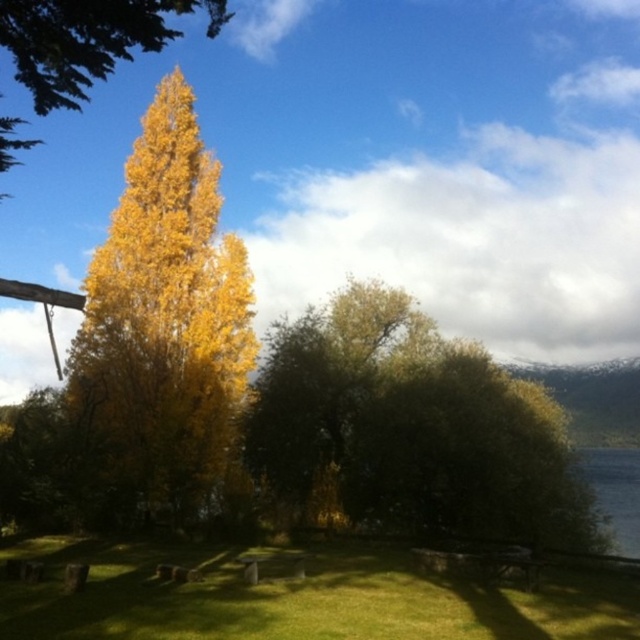
Question: Which point is farther to the camera?

Choices:
 (A) (134, 36)
 (B) (392, 372)
 (C) (99, 352)

Answer: (B)

Question: Which object is the farthest from the golden yellow leaves at upper left?

Choices:
 (A) golden yellow leaves at center
 (B) green leafy tree at center

Answer: (B)

Question: Is green leafy tree at center wider than golden yellow leaves at upper left?

Choices:
 (A) no
 (B) yes

Answer: (A)

Question: Considering the real-world distances, which object is farthest from the green leafy tree at center?

Choices:
 (A) golden yellow leaves at upper left
 (B) golden yellow leaves at center

Answer: (A)

Question: Does green leafy tree at center have a smaller size compared to golden yellow leaves at upper left?

Choices:
 (A) yes
 (B) no

Answer: (A)

Question: Is green leafy tree at center bigger than golden yellow leaves at center?

Choices:
 (A) yes
 (B) no

Answer: (B)